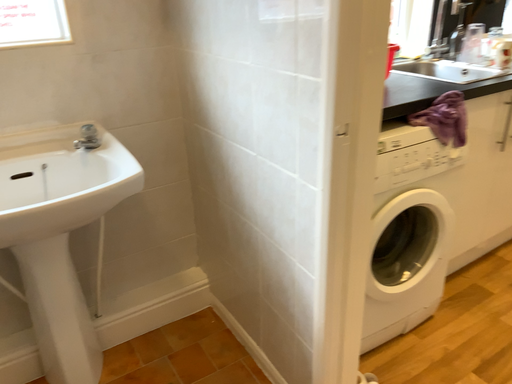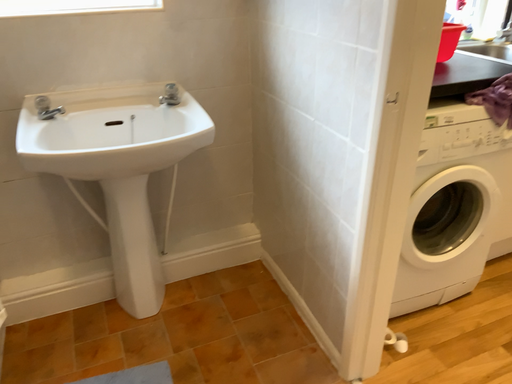
Question: Which way did the camera rotate in the video?

Choices:
 (A) rotated right
 (B) rotated left

Answer: (B)